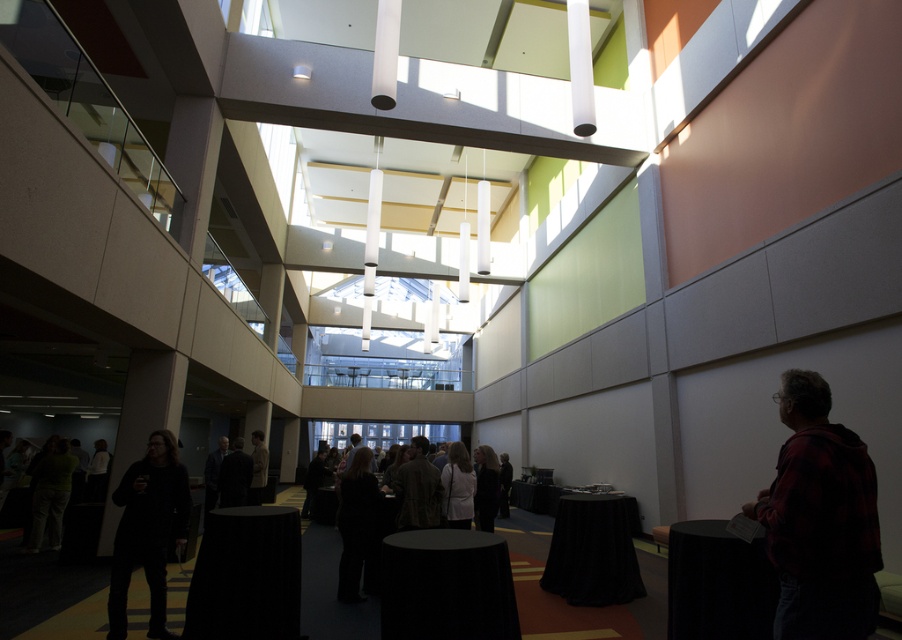
Who is positioned more to the left, red plaid shirt at lower right or white fabric dress at center?

Positioned to the left is white fabric dress at center.

Is red plaid shirt at lower right positioned before white fabric dress at center?

Yes, red plaid shirt at lower right is closer to the viewer.

What do you see at coordinates (820, 518) in the screenshot? I see `red plaid shirt at lower right` at bounding box center [820, 518].

At what (x,y) coordinates should I click in order to perform the action: click on red plaid shirt at lower right. Please return your answer as a coordinate pair (x, y). This screenshot has height=640, width=902. Looking at the image, I should click on (820, 518).

Between point (350, 579) and point (453, 516), which one is positioned in front?

Positioned in front is point (350, 579).

Locate an element on the screen. The width and height of the screenshot is (902, 640). dark gray pants at center is located at coordinates (355, 522).

Find the location of a particular element. dark gray pants at center is located at coordinates (355, 522).

Does point (472, 480) come closer to viewer compared to point (477, 508)?

Yes, point (472, 480) is closer to viewer.

Who is higher up, white fabric dress at center or dark gray sweater at center?

Positioned higher is white fabric dress at center.

Where is `white fabric dress at center`? The image size is (902, 640). white fabric dress at center is located at coordinates (457, 486).